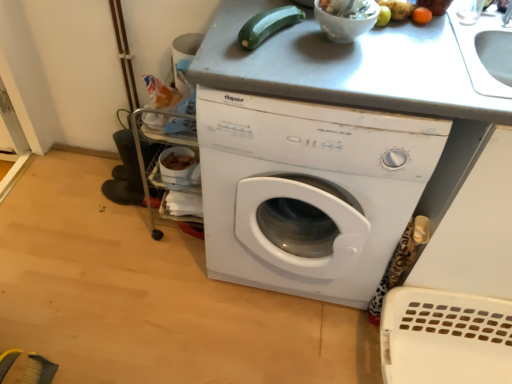
This screenshot has height=384, width=512. What are the coordinates of `vacant area in front of green matte zucchini at upper center, which ranks as the 1th vegetable in left-to-right order` in the screenshot? It's located at (273, 68).